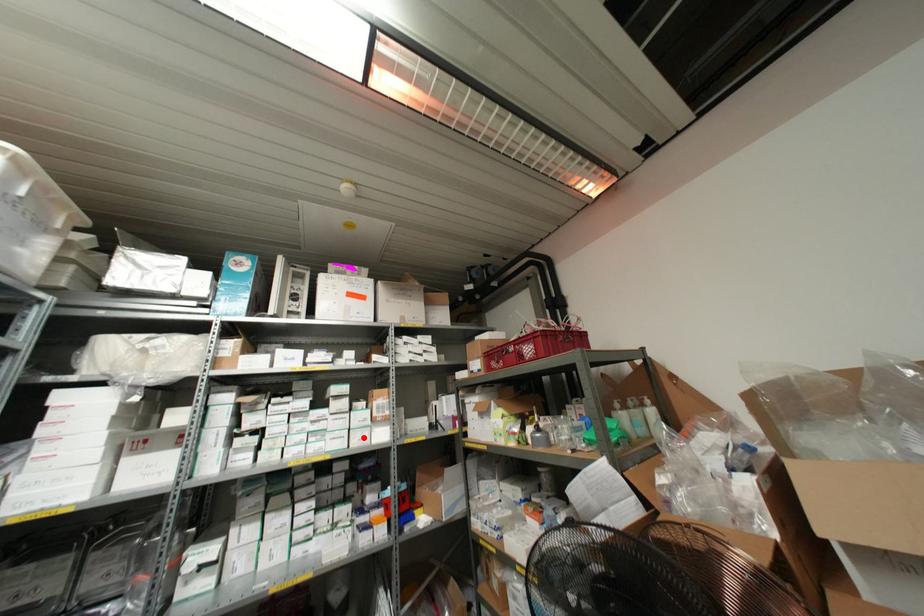
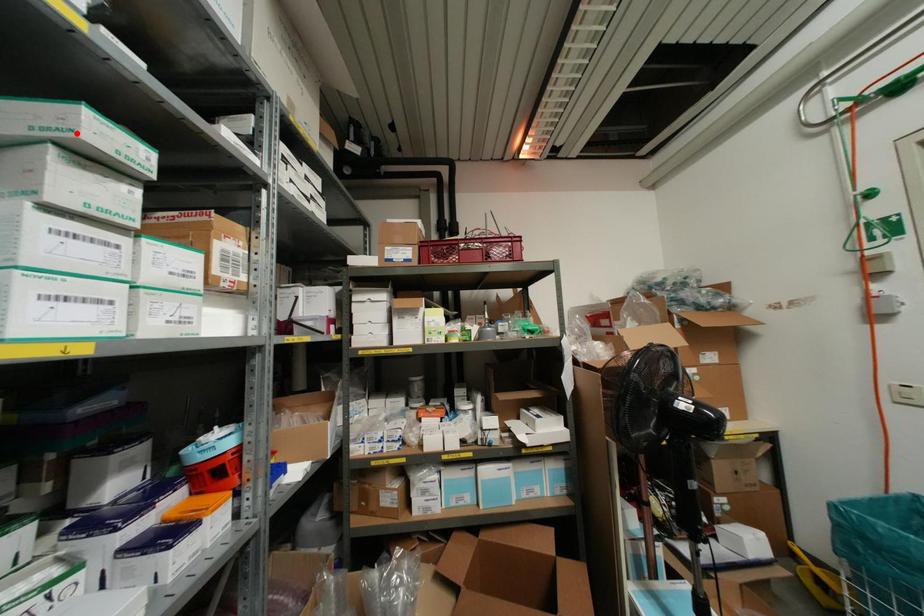
I am providing you with two images of the same scene from different viewpoints. A red point is marked on the first image and another point is marked on the second image. Do the highlighted points in image1 and image2 indicate the same real-world spot?

No